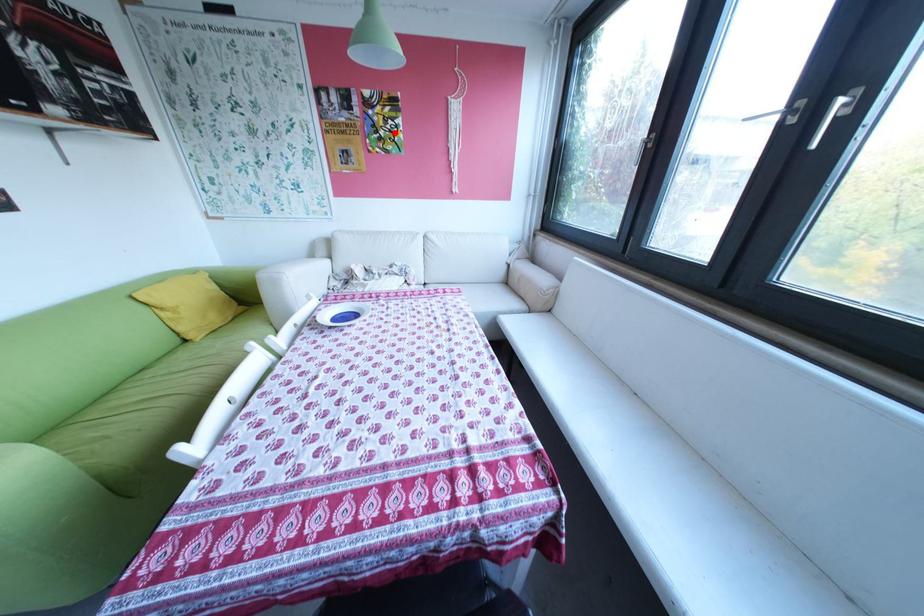
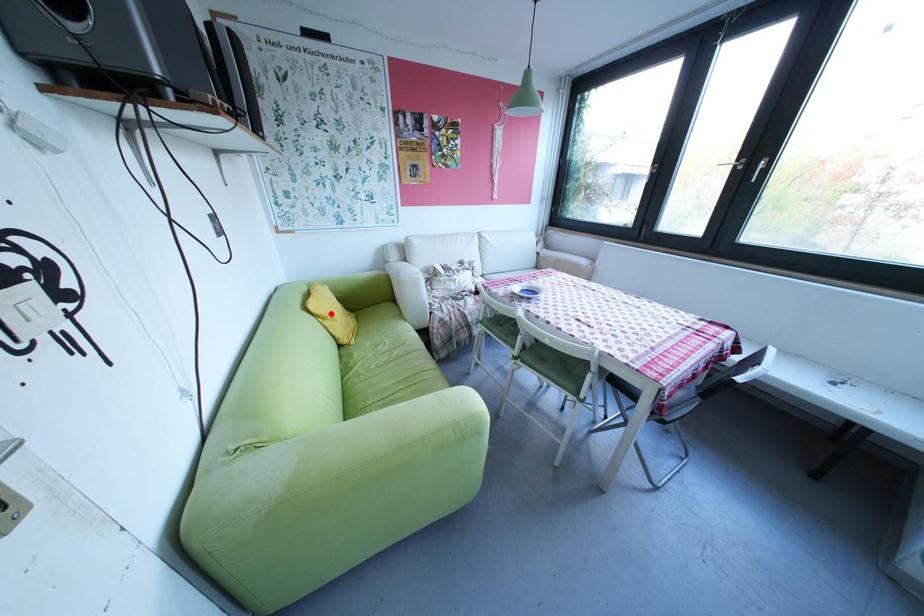
I am providing you with two images of the same scene from different viewpoints. A red point is marked on the first image and another point is marked on the second image. Do the highlighted points in image1 and image2 indicate the same real-world spot?

No